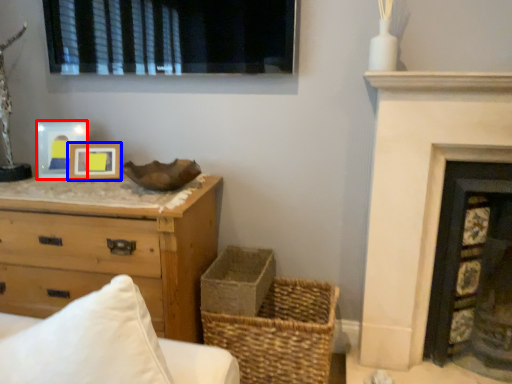
Question: Which object is closer to the camera taking this photo, picture frame (highlighted by a red box) or picture frame (highlighted by a blue box)?

Choices:
 (A) picture frame
 (B) picture frame

Answer: (B)